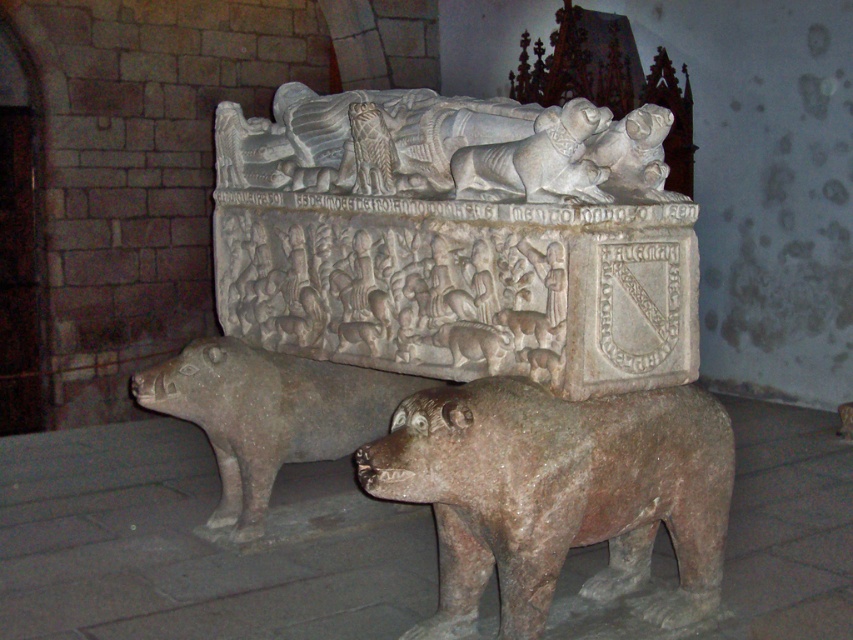
Which is below, rustic stone pig at lower left or gray stone pig at center?

Positioned lower is rustic stone pig at lower left.

Is point (180, 358) positioned in front of point (467, 173)?

No, it is not.

The width and height of the screenshot is (853, 640). Describe the element at coordinates (268, 416) in the screenshot. I see `rustic stone pig at lower left` at that location.

You are a GUI agent. You are given a task and a screenshot of the screen. Output one action in this format:
    pyautogui.click(x=<x>, y=<y>)
    Task: Click on the rustic stone pig at lower left
    This screenshot has width=853, height=640.
    Given the screenshot: What is the action you would take?
    pyautogui.click(x=268, y=416)

Is point (648, 480) less distant than point (480, 172)?

Yes, it is in front of point (480, 172).

Which is below, rustic stone pig at lower center or gray stone pig at center?

rustic stone pig at lower center is lower down.

Describe the element at coordinates (556, 493) in the screenshot. Image resolution: width=853 pixels, height=640 pixels. I see `rustic stone pig at lower center` at that location.

I want to click on rustic stone pig at lower center, so click(556, 493).

Does rustic stone pig at lower center have a larger size compared to rustic stone pig at lower left?

Result: No.

Based on the photo, does rustic stone pig at lower center have a lesser height compared to rustic stone pig at lower left?

Incorrect, rustic stone pig at lower center's height does not fall short of rustic stone pig at lower left's.

Locate an element on the screen. The height and width of the screenshot is (640, 853). rustic stone pig at lower center is located at coordinates (556, 493).